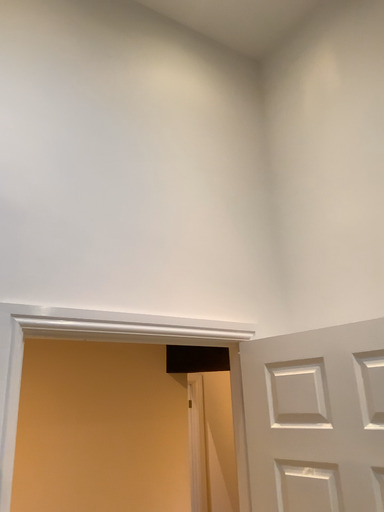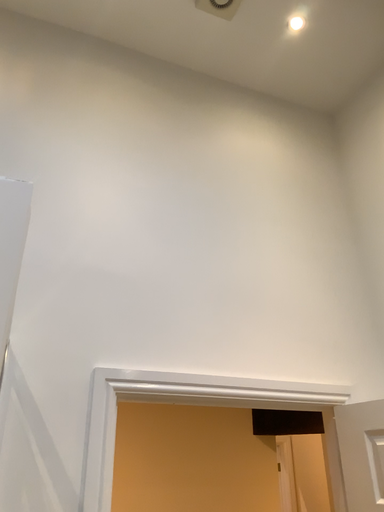
Question: How did the camera likely rotate when shooting the video?

Choices:
 (A) rotated right
 (B) rotated left

Answer: (B)